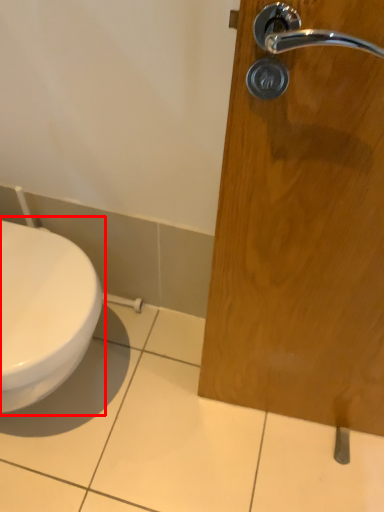
Question: From the image's perspective, where is toilet (annotated by the red box) located relative to door handle?

Choices:
 (A) above
 (B) below

Answer: (A)